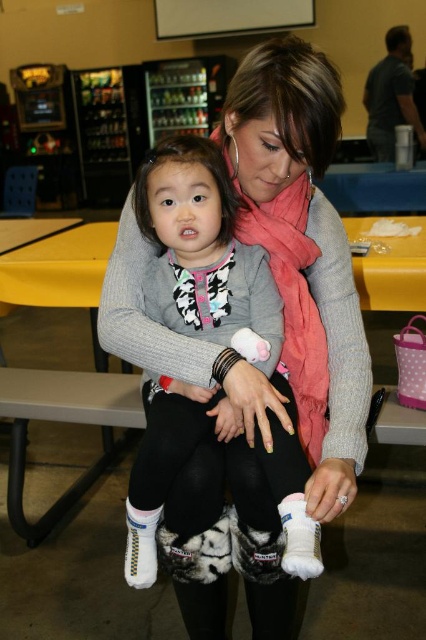
Who is lower down, white fluffy sock at lower center or white knit sock at lower center?

white knit sock at lower center is below.

Locate an element on the screen. The width and height of the screenshot is (426, 640). white fluffy sock at lower center is located at coordinates (299, 538).

Which is behind, point (305, 560) or point (132, 568)?

Point (132, 568)

This screenshot has width=426, height=640. In order to click on white fluffy sock at lower center in this screenshot , I will do `click(299, 538)`.

Who is more forward, (172, 272) or (328, 243)?

Point (172, 272) is more forward.

Does white fuzzy socks at center appear under gray wool sweater at center?

No, white fuzzy socks at center is not below gray wool sweater at center.

I want to click on white fuzzy socks at center, so click(x=203, y=248).

Does gray wool sweater at center have a smaller size compared to white knit sock at lower center?

No.

Who is more forward, (337,289) or (157,512)?

Point (157,512) is more forward.

Image resolution: width=426 pixels, height=640 pixels. I want to click on gray wool sweater at center, so click(x=339, y=365).